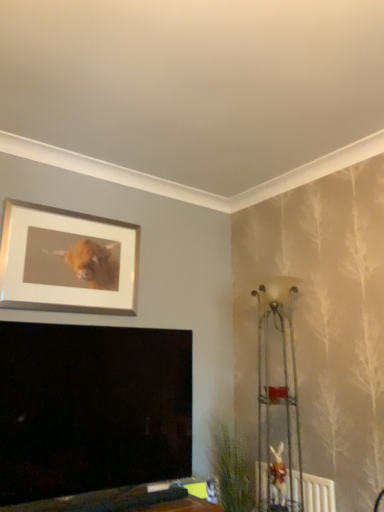
Question: Is silver/metallic picture frame at upper left positioned beyond the bounds of green leafy plant at lower right?

Choices:
 (A) no
 (B) yes

Answer: (B)

Question: Considering the relative sizes of silver/metallic picture frame at upper left and green leafy plant at lower right in the image provided, is silver/metallic picture frame at upper left taller than green leafy plant at lower right?

Choices:
 (A) no
 (B) yes

Answer: (A)

Question: From a real-world perspective, is silver/metallic picture frame at upper left under green leafy plant at lower right?

Choices:
 (A) yes
 (B) no

Answer: (B)

Question: From the image's perspective, would you say silver/metallic picture frame at upper left is shown under green leafy plant at lower right?

Choices:
 (A) yes
 (B) no

Answer: (B)

Question: Is silver/metallic picture frame at upper left closer to the viewer compared to green leafy plant at lower right?

Choices:
 (A) yes
 (B) no

Answer: (A)

Question: Can you confirm if silver/metallic picture frame at upper left is positioned to the right of green leafy plant at lower right?

Choices:
 (A) yes
 (B) no

Answer: (B)

Question: Does white textured radiator at lower right lie in front of silver/metallic picture frame at upper left?

Choices:
 (A) yes
 (B) no

Answer: (A)

Question: Considering the relative sizes of white textured radiator at lower right and silver/metallic picture frame at upper left in the image provided, is white textured radiator at lower right bigger than silver/metallic picture frame at upper left?

Choices:
 (A) no
 (B) yes

Answer: (A)

Question: Is the position of white textured radiator at lower right more distant than that of silver/metallic picture frame at upper left?

Choices:
 (A) no
 (B) yes

Answer: (A)

Question: Considering the relative sizes of white textured radiator at lower right and silver/metallic picture frame at upper left in the image provided, is white textured radiator at lower right thinner than silver/metallic picture frame at upper left?

Choices:
 (A) no
 (B) yes

Answer: (A)

Question: Can you confirm if white textured radiator at lower right is smaller than silver/metallic picture frame at upper left?

Choices:
 (A) no
 (B) yes

Answer: (B)

Question: Is white textured radiator at lower right turned away from silver/metallic picture frame at upper left?

Choices:
 (A) yes
 (B) no

Answer: (B)

Question: Is silver/metallic picture frame at upper left facing towards metallic wire rack at right?

Choices:
 (A) yes
 (B) no

Answer: (B)